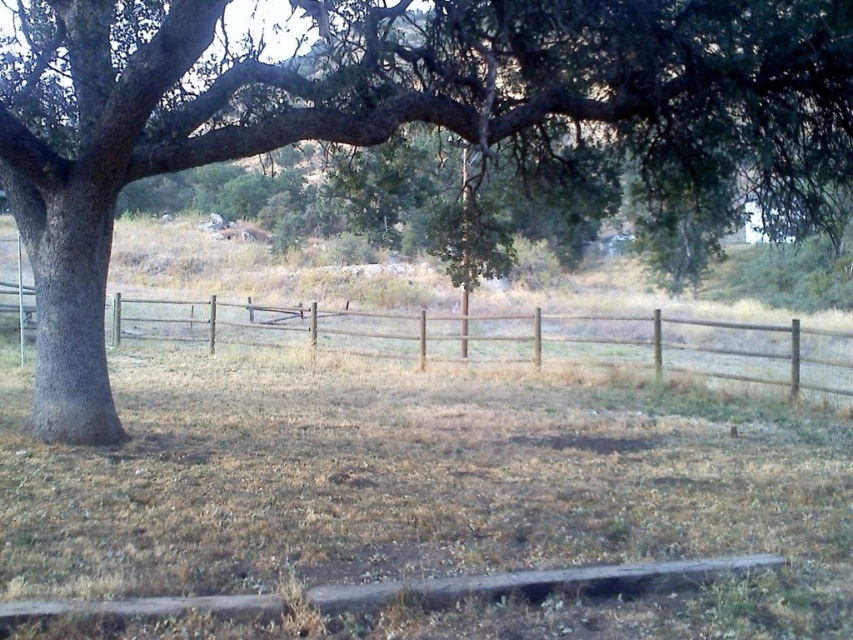
Question: Among these points, which one is farthest from the camera?

Choices:
 (A) (494, 150)
 (B) (312, 339)
 (C) (773, 477)

Answer: (B)

Question: Among these objects, which one is nearest to the camera?

Choices:
 (A) green rough bark tree at left
 (B) brown wooden fence at center
 (C) dry grass at center

Answer: (C)

Question: Does dry grass at center lie behind green rough bark tree at left?

Choices:
 (A) no
 (B) yes

Answer: (A)

Question: Can you confirm if green rough bark tree at left is positioned to the left of brown wooden fence at center?

Choices:
 (A) no
 (B) yes

Answer: (A)

Question: Based on their relative distances, which object is farther from the dry grass at center?

Choices:
 (A) green rough bark tree at left
 (B) brown wooden fence at center

Answer: (B)

Question: Can you confirm if dry grass at center is positioned above brown wooden fence at center?

Choices:
 (A) no
 (B) yes

Answer: (A)